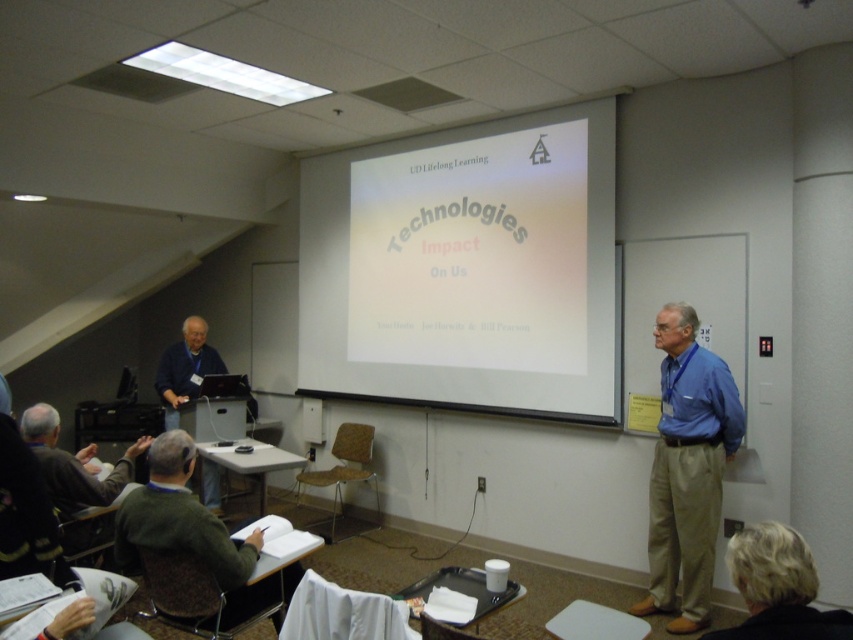
Question: Considering the real-world distances, which object is closest to the white glossy projector screen at center?

Choices:
 (A) blonde hair at lower right
 (B) blue cotton shirt at right

Answer: (B)

Question: Does white glossy projector screen at center appear over matte blue shirt at left?

Choices:
 (A) yes
 (B) no

Answer: (A)

Question: Can you confirm if white glossy projector screen at center is positioned to the right of blonde hair at lower right?

Choices:
 (A) no
 (B) yes

Answer: (A)

Question: From the image, what is the correct spatial relationship of green fabric chair at lower left in relation to matte blue shirt at left?

Choices:
 (A) left
 (B) right

Answer: (B)

Question: Which object appears closest to the camera in this image?

Choices:
 (A) blonde hair at lower right
 (B) matte blue shirt at left
 (C) blue cotton shirt at right

Answer: (A)

Question: Which of these objects is positioned farthest from the green fabric chair at lower left?

Choices:
 (A) blonde hair at lower right
 (B) matte blue shirt at left

Answer: (B)